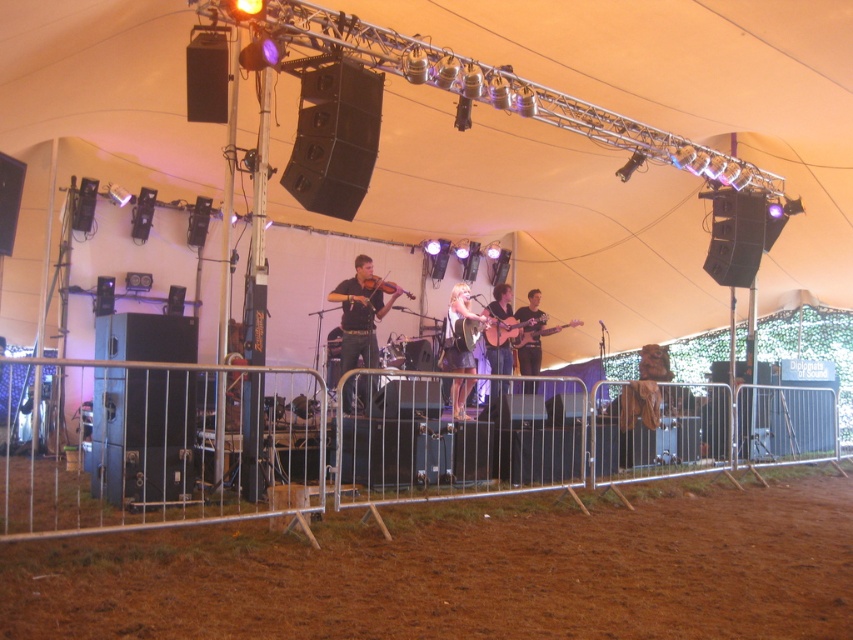
From the picture: How far apart are light brown wood guitar at center and matte black guitar at center?

light brown wood guitar at center is 17.50 inches from matte black guitar at center.

Can you confirm if light brown wood guitar at center is wider than matte black guitar at center?

Indeed, light brown wood guitar at center has a greater width compared to matte black guitar at center.

At what (x,y) coordinates should I click in order to perform the action: click on light brown wood guitar at center. Please return your answer as a coordinate pair (x, y). Looking at the image, I should click on (456, 330).

Between matte black guitar at center and acoustic wood guitar at center, which one has more height?

Standing taller between the two is matte black guitar at center.

Between matte black guitar at center and acoustic wood guitar at center, which one is positioned lower?

Positioned lower is matte black guitar at center.

Which is in front, point (502, 369) or point (517, 332)?

Point (502, 369) is more forward.

You are a GUI agent. You are given a task and a screenshot of the screen. Output one action in this format:
    pyautogui.click(x=<x>, y=<y>)
    Task: Click on the matte black guitar at center
    The width and height of the screenshot is (853, 640).
    Given the screenshot: What is the action you would take?
    pyautogui.click(x=498, y=305)

Who is shorter, light brown wood guitar at center or wooden violin at center?

wooden violin at center is shorter.

Find the location of `light brown wood guitar at center`. light brown wood guitar at center is located at coordinates (456, 330).